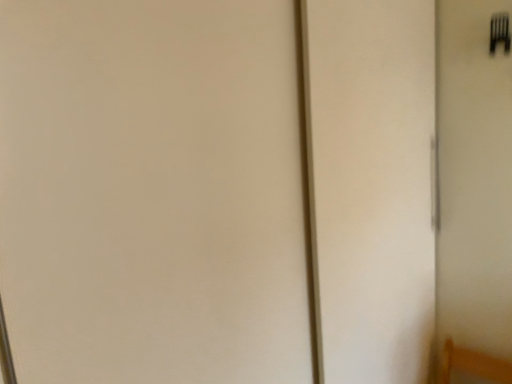
Question: Should I look upward or downward to see black plastic fork at upper right?

Choices:
 (A) up
 (B) down

Answer: (A)